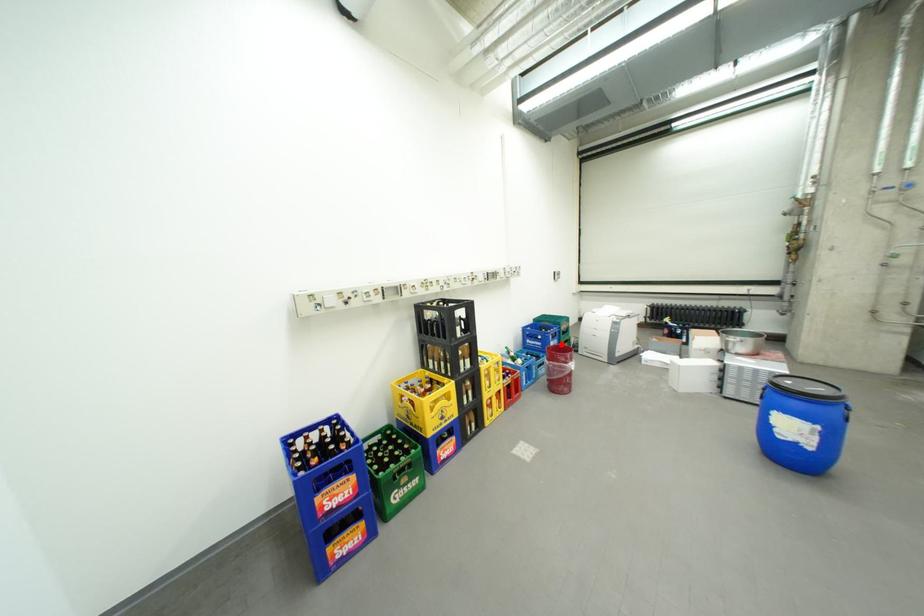
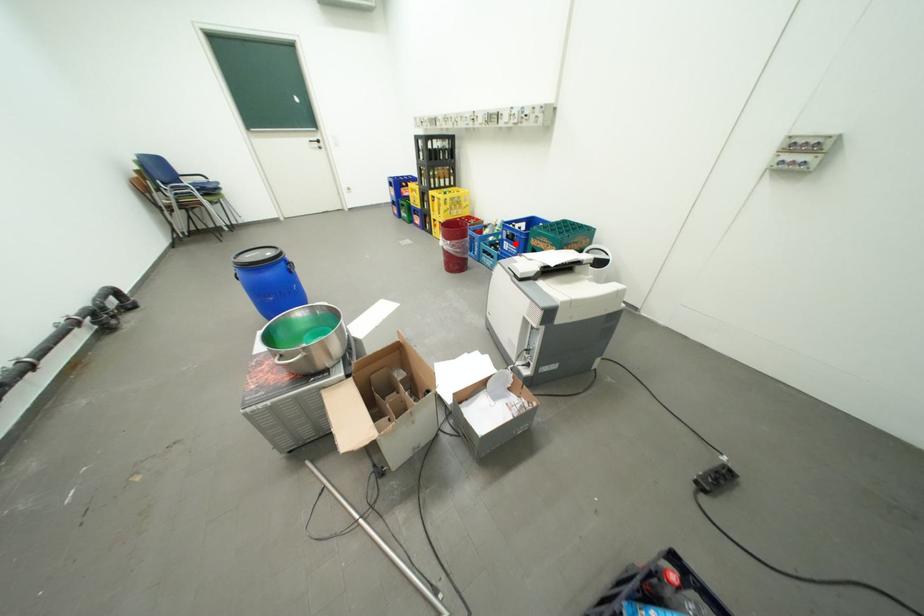
Consider the image. I am providing you with two images of the same scene from different viewpoints. A red point is marked on the first image and another point is marked on the second image. Is the marked point in image1 the same physical position as the marked point in image2?

Yes